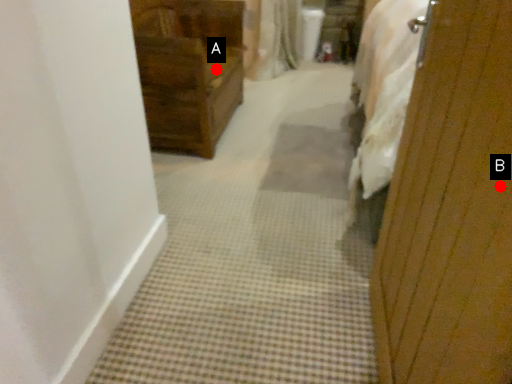
Question: Two points are circled on the image, labeled by A and B beside each circle. Among these points, which one is farthest from the camera?

Choices:
 (A) A is further
 (B) B is further

Answer: (A)